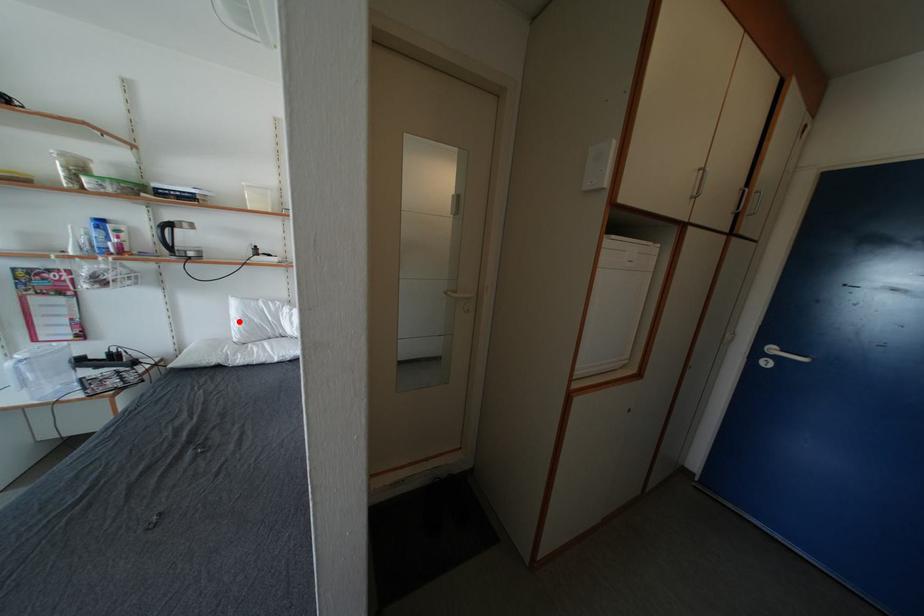
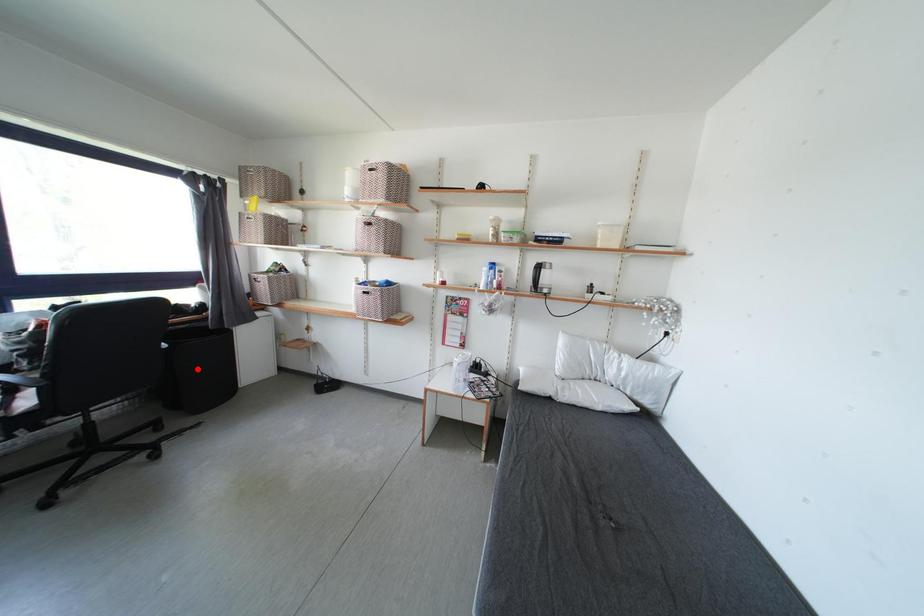
I am providing you with two images of the same scene from different viewpoints. A red point is marked on the first image and another point is marked on the second image. Does the point marked in image1 correspond to the same location as the one in image2?

No